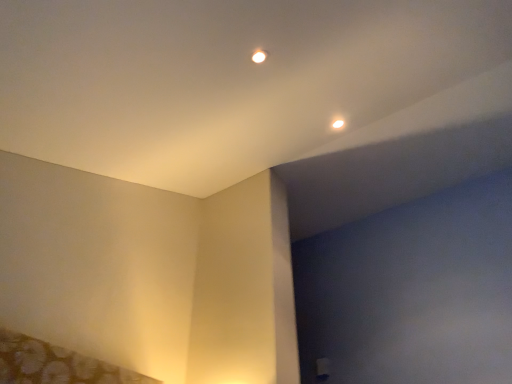
Describe the element at coordinates (259, 56) in the screenshot. I see `white glossy light at upper center` at that location.

Image resolution: width=512 pixels, height=384 pixels. I want to click on white glossy light at upper center, so click(259, 56).

Locate an element on the screen. The height and width of the screenshot is (384, 512). white glossy light at upper center is located at coordinates (259, 56).